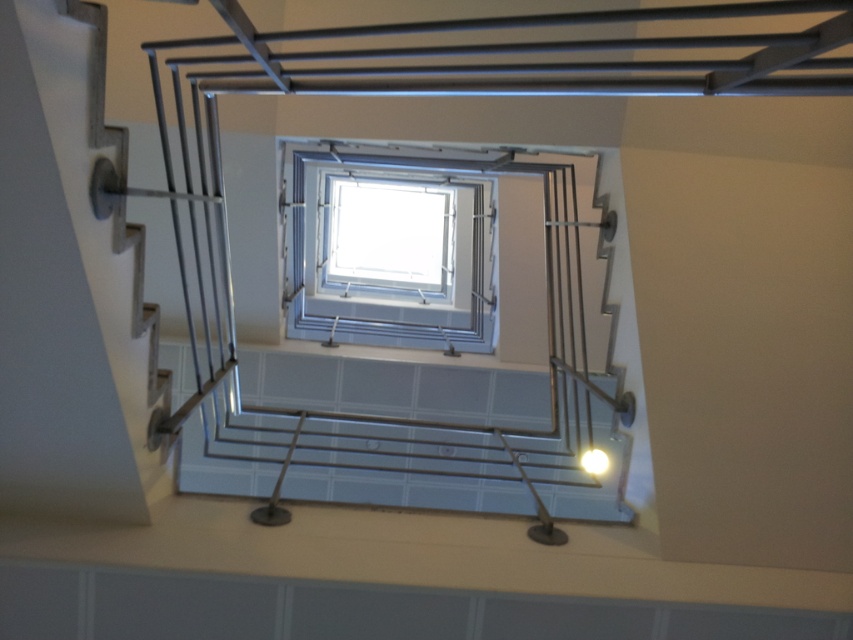
You are standing at the bottom of the staircase and want to know if the transparent glass window at center will block your view of the bright yellow bulb at center. Can you see the bulb through the window?

The transparent glass window at center is bigger than the bright yellow bulb at center, so the bulb is behind the window and cannot be seen through it.

You are standing at the bottom of the staircase and want to check if the bright yellow bulb at center is visible through the transparent glass window at center. Based on the scene description, can you see the bulb through the window?

The bright yellow bulb at center is behind the transparent glass window at center, so yes, you can see the bulb through the window.